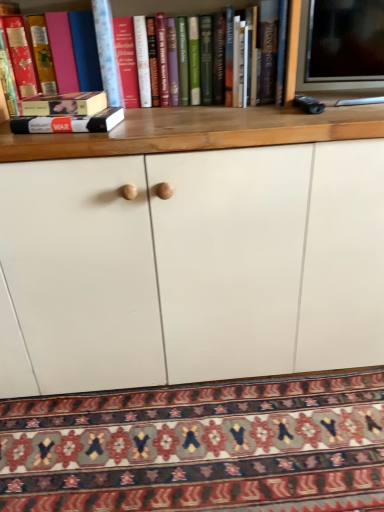
Identify the location of empty space that is ontop of patterned carpet at lower center (from a real-world perspective). The width and height of the screenshot is (384, 512). (203, 446).